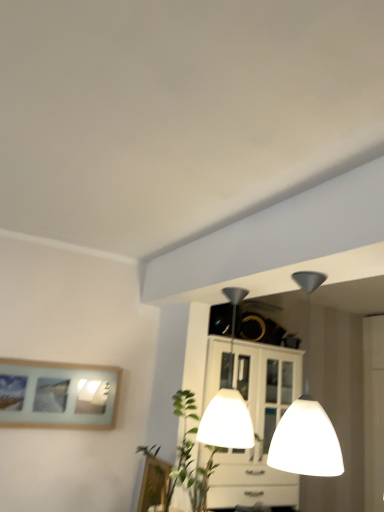
Question: Considering the positions of white glossy lampshade at upper center, marked as the second lamp in a back-to-front arrangement, and wooden picture frame at lower center, the first picture frame in the bottom-to-top sequence, in the image, is white glossy lampshade at upper center, marked as the second lamp in a back-to-front arrangement, taller or shorter than wooden picture frame at lower center, the first picture frame in the bottom-to-top sequence,?

Choices:
 (A) tall
 (B) short

Answer: (A)

Question: Considering the positions of point (297, 419) and point (160, 460), is point (297, 419) closer or farther from the camera than point (160, 460)?

Choices:
 (A) farther
 (B) closer

Answer: (B)

Question: Based on their relative distances, which object is nearer to the white glossy lampshade at center, which is the 2th lamp in front-to-back order?

Choices:
 (A) wooden picture frame at lower center, the 2th picture frame in the left-to-right sequence
 (B) wooden framed picture at left, the first picture frame viewed from the left
 (C) green leafy plant at center
 (D) white glossy lampshade at upper center, marked as the second lamp in a back-to-front arrangement

Answer: (C)

Question: Which object is the farthest from the white glossy lampshade at upper center, acting as the first lamp starting from the front?

Choices:
 (A) green leafy plant at center
 (B) white glossy lampshade at center, acting as the first lamp starting from the back
 (C) wooden framed picture at left, marked as the 2th picture frame in a right-to-left arrangement
 (D) wooden picture frame at lower center, arranged as the first picture frame when viewed from the right

Answer: (C)